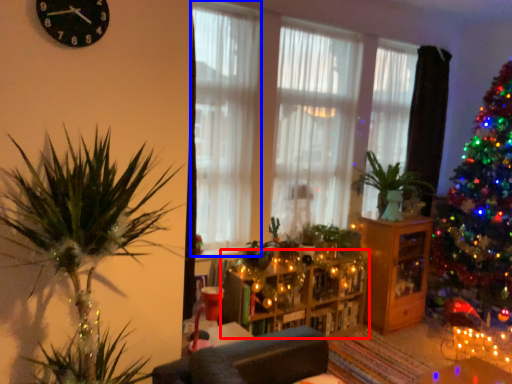
Question: Which object appears farthest to the camera in this image, entertainment center (highlighted by a red box) or curtain (highlighted by a blue box)?

Choices:
 (A) entertainment center
 (B) curtain

Answer: (A)